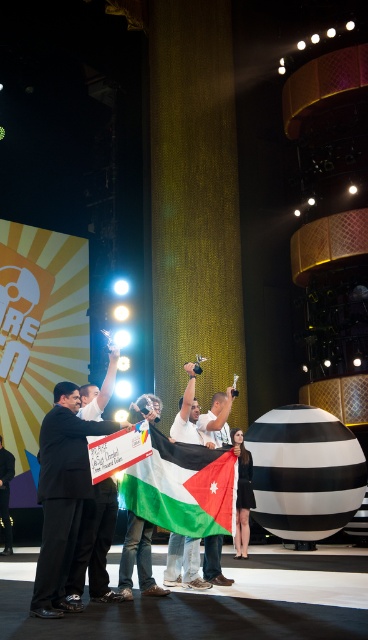
Does white cotton shirt at center have a greater width compared to white cotton dress at center?

Yes.

Is white cotton shirt at center positioned behind white cotton dress at center?

That is False.

What are the coordinates of `white cotton shirt at center` in the screenshot? It's located at (138, 557).

The image size is (368, 640). Identify the location of white cotton shirt at center. (138, 557).

Is green and white fabric flag at center below white cotton dress at center?

Actually, green and white fabric flag at center is above white cotton dress at center.

Is point (213, 483) positioned before point (236, 540)?

Yes, point (213, 483) is in front of point (236, 540).

I want to click on green and white fabric flag at center, so click(x=182, y=486).

From the picture: Can you confirm if white cotton t-shirt at center is shorter than white cotton shirt at center?

Yes.

Is point (193, 372) more distant than point (131, 576)?

Yes, it is.

Find the location of `white cotton t-shirt at center`. white cotton t-shirt at center is located at coordinates (192, 561).